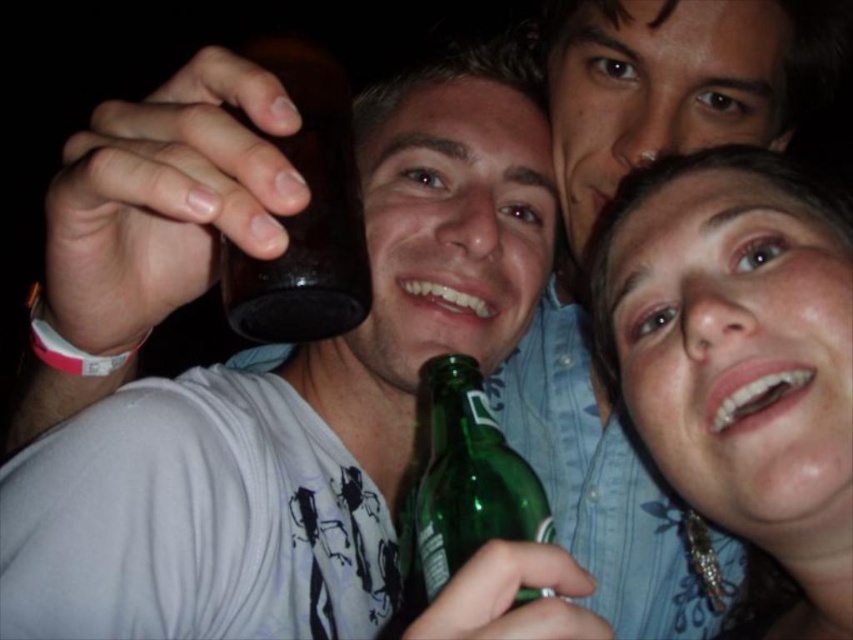
You are at a party and need to grab a bottle from the table. The brown glass bottle at upper left and the green glass bottle at lower center are both on the table. Which one is easier to reach without moving the other?

The green glass bottle at lower center is easier to reach because it is positioned below the brown glass bottle at upper left, meaning it is closer to you.

You are at a party and want to grab a drink. You see a brown glass bottle at upper left and a green glass bottle at lower center. Which one is positioned to the left?

The brown glass bottle at upper left is positioned to the left of the green glass bottle at lower center.